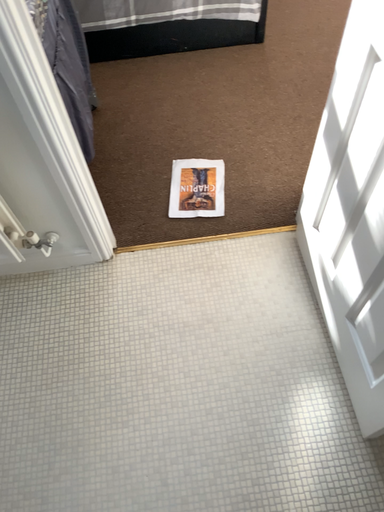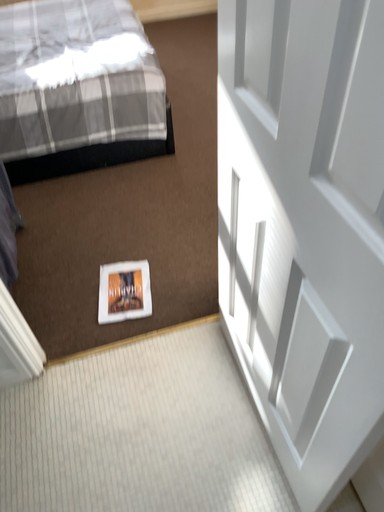
Question: How did the camera likely rotate when shooting the video?

Choices:
 (A) rotated upward
 (B) rotated downward

Answer: (A)